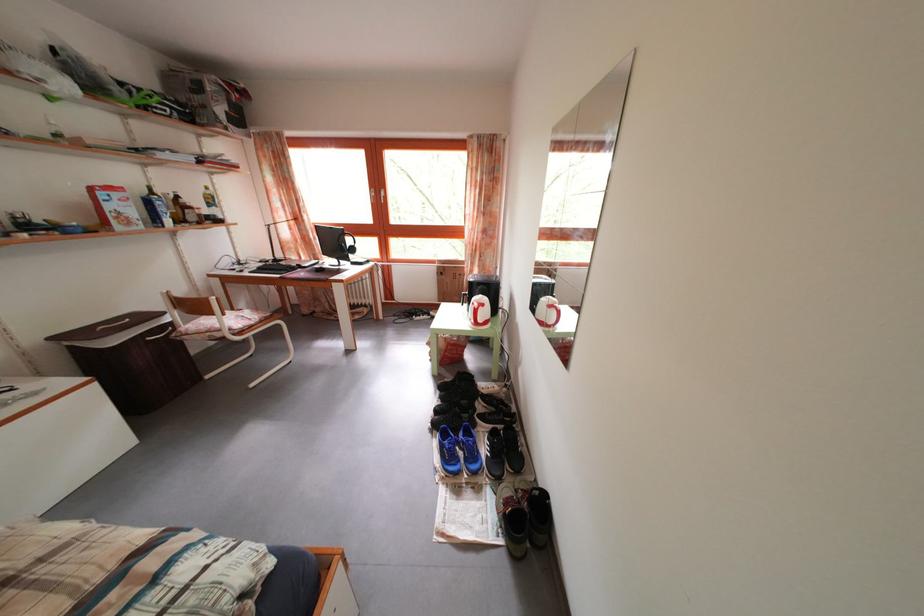
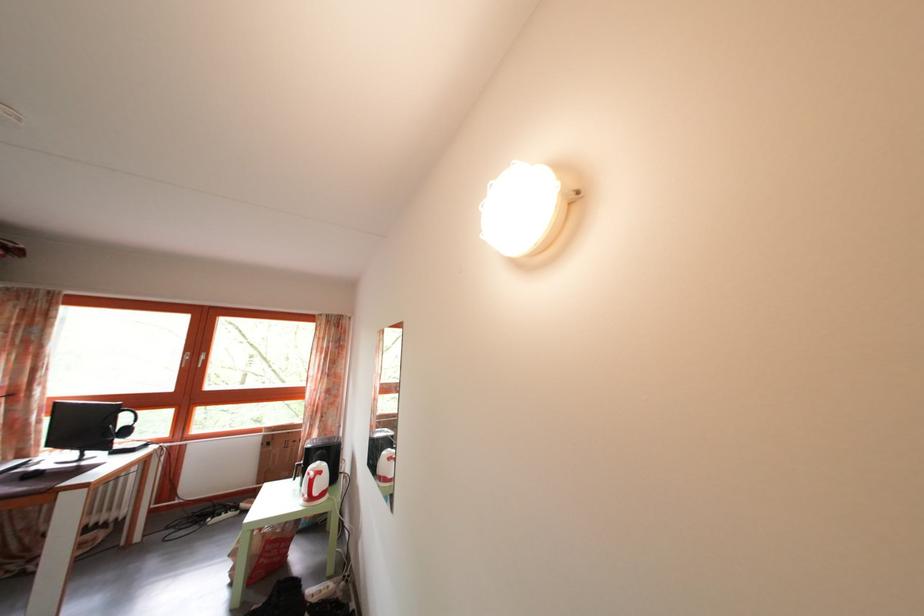
Find the pixel in the second image that matches [490,312] in the first image.

(327, 480)